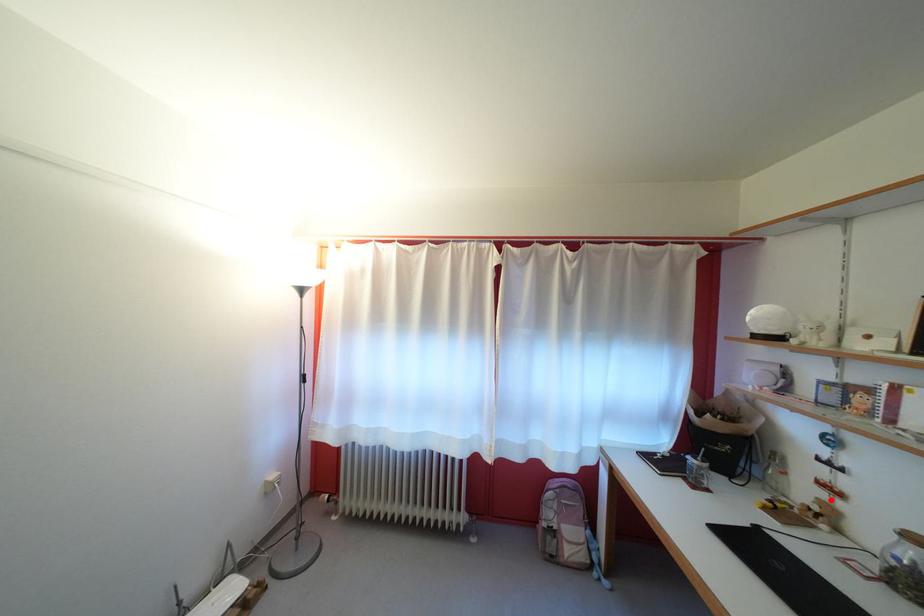
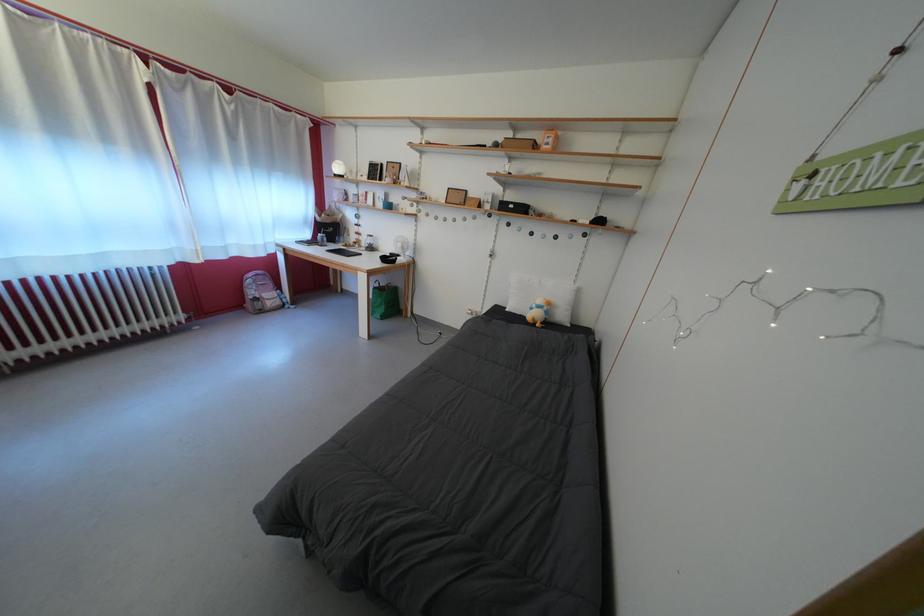
The point at the highlighted location is marked in the first image. Where is the corresponding point in the second image?

(365, 243)